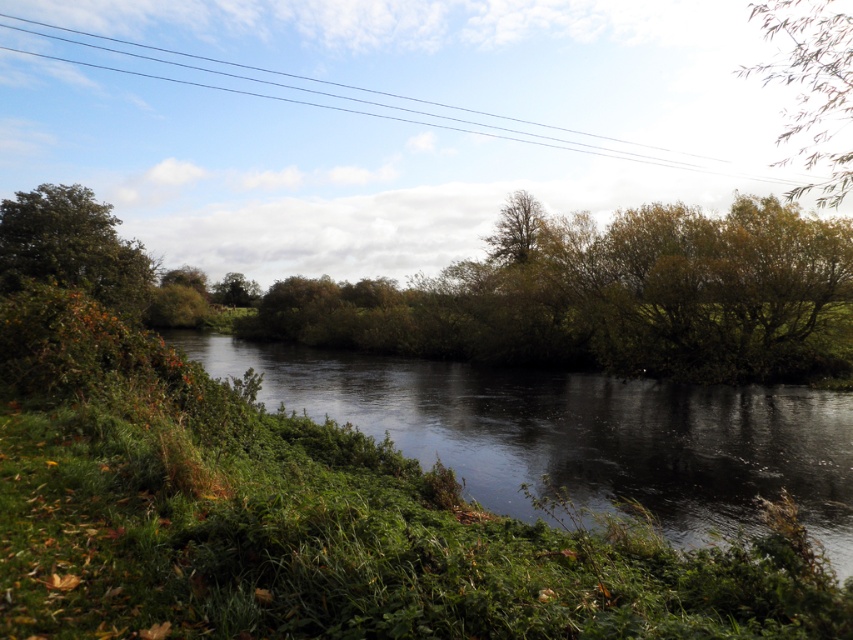
Based on the photo, between green grassy river at center and green leafy tree at center, which one is positioned higher?

green leafy tree at center is above.

Does point (697, 440) come farther from viewer compared to point (257, 284)?

No, (697, 440) is in front of (257, 284).

At what (x,y) coordinates should I click in order to perform the action: click on green grassy river at center. Please return your answer as a coordinate pair (x, y). The width and height of the screenshot is (853, 640). Looking at the image, I should click on (579, 435).

The image size is (853, 640). In order to click on green grassy river at center in this screenshot , I will do `click(579, 435)`.

This screenshot has height=640, width=853. What do you see at coordinates (579, 435) in the screenshot?
I see `green grassy river at center` at bounding box center [579, 435].

Between green grassy river at center and green leafy tree at left, which one appears on the left side from the viewer's perspective?

green leafy tree at left

Is point (685, 420) positioned behind point (50, 262)?

No, (685, 420) is in front of (50, 262).

The width and height of the screenshot is (853, 640). In order to click on green grassy river at center in this screenshot , I will do `click(579, 435)`.

Describe the element at coordinates (467, 67) in the screenshot. I see `black wire at upper center` at that location.

Is black wire at upper center positioned in front of green leafy tree at left?

Yes.

The image size is (853, 640). Identify the location of black wire at upper center. (467, 67).